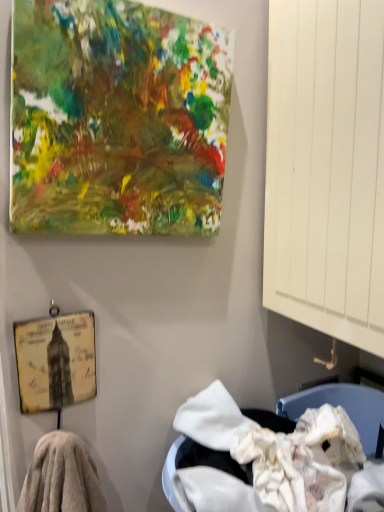
Question: From the image's perspective, is fuzzy towel at lower left on top of yellowed paper picture frame at lower left?

Choices:
 (A) no
 (B) yes

Answer: (A)

Question: From a real-world perspective, is fuzzy towel at lower left physically above yellowed paper picture frame at lower left?

Choices:
 (A) no
 (B) yes

Answer: (A)

Question: Is fuzzy towel at lower left to the right of yellowed paper picture frame at lower left from the viewer's perspective?

Choices:
 (A) no
 (B) yes

Answer: (B)

Question: Is yellowed paper picture frame at lower left surrounded by fuzzy towel at lower left?

Choices:
 (A) yes
 (B) no

Answer: (B)

Question: Is fuzzy towel at lower left bigger than yellowed paper picture frame at lower left?

Choices:
 (A) no
 (B) yes

Answer: (B)

Question: Does fuzzy towel at lower left appear on the left side of yellowed paper picture frame at lower left?

Choices:
 (A) yes
 (B) no

Answer: (B)

Question: Is abstract multicolored canvas at upper left outside of yellowed paper picture frame at lower left?

Choices:
 (A) no
 (B) yes

Answer: (B)

Question: Is abstract multicolored canvas at upper left aimed at yellowed paper picture frame at lower left?

Choices:
 (A) yes
 (B) no

Answer: (B)

Question: From the image's perspective, is abstract multicolored canvas at upper left located beneath yellowed paper picture frame at lower left?

Choices:
 (A) yes
 (B) no

Answer: (B)

Question: Would you say abstract multicolored canvas at upper left is a long distance from yellowed paper picture frame at lower left?

Choices:
 (A) yes
 (B) no

Answer: (B)

Question: Can you confirm if abstract multicolored canvas at upper left is thinner than yellowed paper picture frame at lower left?

Choices:
 (A) no
 (B) yes

Answer: (A)

Question: Is abstract multicolored canvas at upper left further to camera compared to yellowed paper picture frame at lower left?

Choices:
 (A) no
 (B) yes

Answer: (A)

Question: Does yellowed paper picture frame at lower left have a lesser width compared to abstract multicolored canvas at upper left?

Choices:
 (A) yes
 (B) no

Answer: (A)